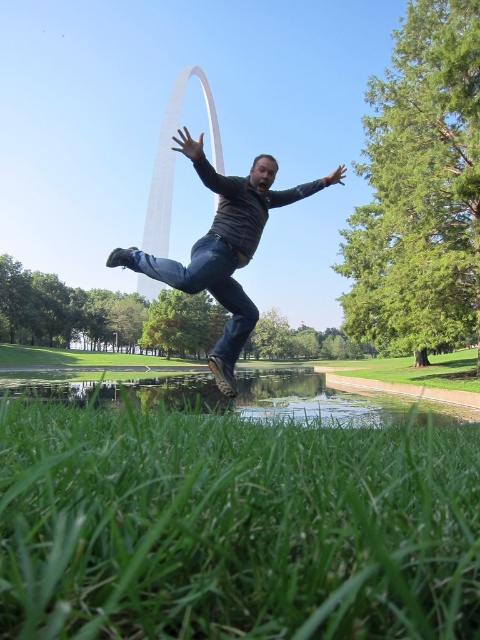
Does point (228, 349) lie behind point (216, 182)?

Yes.

What do you see at coordinates (224, 246) in the screenshot? I see `jeans at center` at bounding box center [224, 246].

Is point (227, 349) closer to viewer compared to point (193, 148)?

No, it is not.

Find the location of a particular element. jeans at center is located at coordinates (224, 246).

Is green grass at lower center smaller than denim at center?

Actually, green grass at lower center might be larger than denim at center.

This screenshot has width=480, height=640. Identify the location of green grass at lower center. (233, 524).

This screenshot has width=480, height=640. What do you see at coordinates (233, 524) in the screenshot?
I see `green grass at lower center` at bounding box center [233, 524].

Does green grass at lower center come in front of matte black arm at center?

Yes, it is.

Is point (205, 483) closer to viewer compared to point (336, 180)?

Yes, it is in front of point (336, 180).

Locate an element on the screen. green grass at lower center is located at coordinates (233, 524).